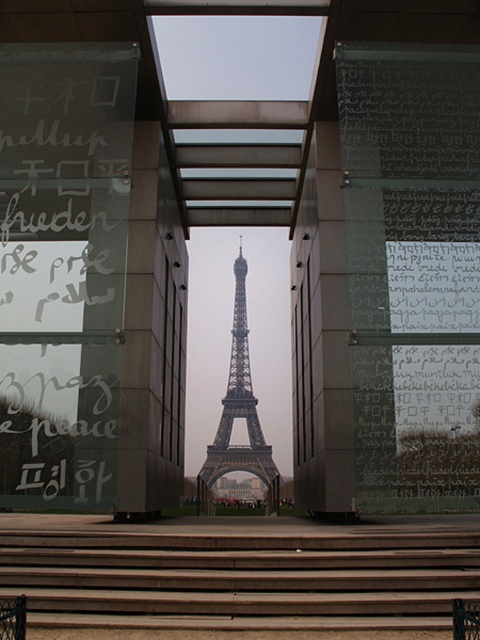
You are a tourist standing at the base of the brown wooden stairs at center, looking up towards the metallic gray eiffel tower at center. Which object is closer to you?

The brown wooden stairs at center is positioned under metallic gray eiffel tower at center, so the stairs are closer to you since they are directly beneath the tower.

You are a tourist standing at the base of the brown wooden stairs at center and want to take a photo of the metallic gray eiffel tower at center through the rectangular opening. Considering their sizes, will the entire eiffel tower fit in the frame if you position yourself at the bottom of the stairs?

The brown wooden stairs at center is smaller than the metallic gray eiffel tower at center. Since the stairs are smaller, positioning yourself at the bottom might not allow the entire Eiffel Tower to fit in the frame as the tower is larger in size relative to the stairs.